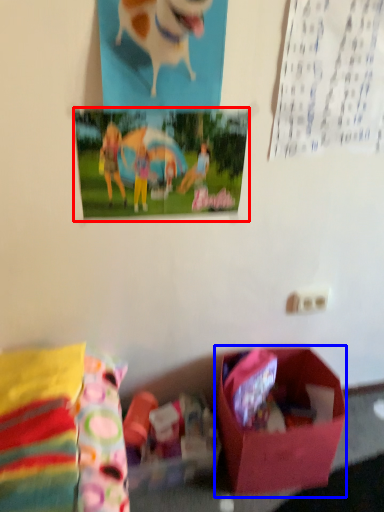
Question: Which object appears closest to the camera in this image, postcard (highlighted by a red box) or box (highlighted by a blue box)?

Choices:
 (A) postcard
 (B) box

Answer: (A)